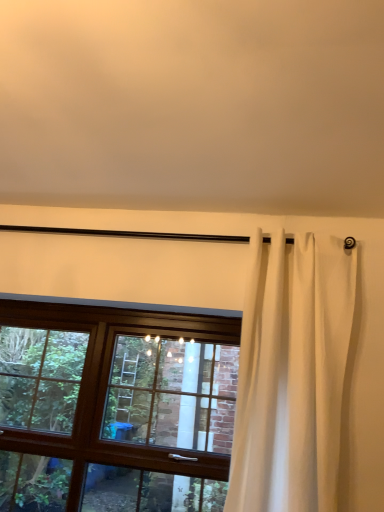
Question: Considering the relative sizes of white sheer curtain at right and brown wooden window at center in the image provided, is white sheer curtain at right wider than brown wooden window at center?

Choices:
 (A) yes
 (B) no

Answer: (A)

Question: Does white sheer curtain at right come behind brown wooden window at center?

Choices:
 (A) no
 (B) yes

Answer: (A)

Question: Is white sheer curtain at right closer to camera compared to brown wooden window at center?

Choices:
 (A) no
 (B) yes

Answer: (B)

Question: Is white sheer curtain at right bigger than brown wooden window at center?

Choices:
 (A) yes
 (B) no

Answer: (B)

Question: From the image's perspective, is white sheer curtain at right over brown wooden window at center?

Choices:
 (A) no
 (B) yes

Answer: (B)

Question: Considering the relative positions of white sheer curtain at right and brown wooden window at center in the image provided, is white sheer curtain at right to the left of brown wooden window at center from the viewer's perspective?

Choices:
 (A) no
 (B) yes

Answer: (A)

Question: Is brown wooden window at center not within white sheer curtain at right?

Choices:
 (A) no
 (B) yes

Answer: (B)

Question: Can you confirm if brown wooden window at center is thinner than white sheer curtain at right?

Choices:
 (A) no
 (B) yes

Answer: (B)

Question: From a real-world perspective, does brown wooden window at center stand above white sheer curtain at right?

Choices:
 (A) yes
 (B) no

Answer: (B)

Question: Is brown wooden window at center smaller than white sheer curtain at right?

Choices:
 (A) no
 (B) yes

Answer: (A)

Question: Does brown wooden window at center have a greater height compared to white sheer curtain at right?

Choices:
 (A) no
 (B) yes

Answer: (A)

Question: Is brown wooden window at center further to camera compared to white sheer curtain at right?

Choices:
 (A) no
 (B) yes

Answer: (B)

Question: Considering the positions of white sheer curtain at right and brown wooden window at center in the image, is white sheer curtain at right wider or thinner than brown wooden window at center?

Choices:
 (A) thin
 (B) wide

Answer: (B)